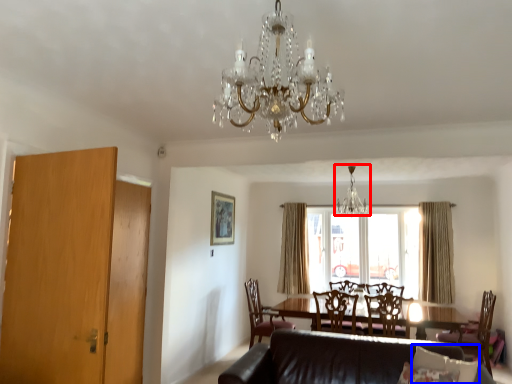
Question: Which object is further to the camera taking this photo, chandelier (highlighted by a red box) or pillow (highlighted by a blue box)?

Choices:
 (A) chandelier
 (B) pillow

Answer: (A)